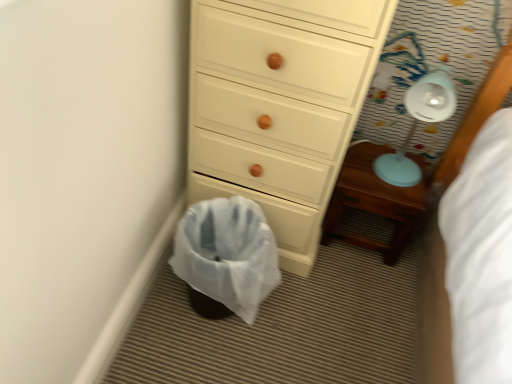
Where is `free location above wooden nightstand at lower right (from a real-world perspective)`? This screenshot has height=384, width=512. free location above wooden nightstand at lower right (from a real-world perspective) is located at coordinates (378, 169).